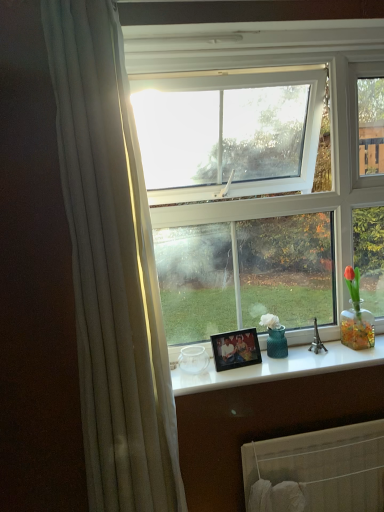
Question: Is the position of wooden photo frame at center more distant than that of white fabric radiator at lower center?

Choices:
 (A) yes
 (B) no

Answer: (A)

Question: From the image's perspective, is wooden photo frame at center on white fabric radiator at lower center?

Choices:
 (A) no
 (B) yes

Answer: (B)

Question: Does wooden photo frame at center appear on the right side of white fabric radiator at lower center?

Choices:
 (A) no
 (B) yes

Answer: (A)

Question: Would you consider wooden photo frame at center to be distant from white fabric radiator at lower center?

Choices:
 (A) yes
 (B) no

Answer: (B)

Question: Considering the relative sizes of wooden photo frame at center and white fabric radiator at lower center in the image provided, is wooden photo frame at center wider than white fabric radiator at lower center?

Choices:
 (A) no
 (B) yes

Answer: (A)

Question: In terms of height, does white fabric radiator at lower center look taller or shorter compared to wooden photo frame at center?

Choices:
 (A) short
 (B) tall

Answer: (B)

Question: Is white fabric radiator at lower center inside or outside of wooden photo frame at center?

Choices:
 (A) inside
 (B) outside

Answer: (B)

Question: Looking at their shapes, would you say white fabric radiator at lower center is wider or thinner than wooden photo frame at center?

Choices:
 (A) wide
 (B) thin

Answer: (A)

Question: Considering the relative positions of white fabric radiator at lower center and wooden photo frame at center in the image provided, is white fabric radiator at lower center to the left or to the right of wooden photo frame at center?

Choices:
 (A) right
 (B) left

Answer: (A)

Question: In the image, is white fabric radiator at lower center positioned in front of or behind white glossy counter top at center?

Choices:
 (A) behind
 (B) front

Answer: (A)

Question: From the image's perspective, is white fabric radiator at lower center positioned above or below white glossy counter top at center?

Choices:
 (A) below
 (B) above

Answer: (A)

Question: Considering the positions of white fabric radiator at lower center and white glossy counter top at center in the image, is white fabric radiator at lower center wider or thinner than white glossy counter top at center?

Choices:
 (A) wide
 (B) thin

Answer: (B)

Question: Considering the positions of point (380, 496) and point (281, 362), is point (380, 496) closer or farther from the camera than point (281, 362)?

Choices:
 (A) closer
 (B) farther

Answer: (B)

Question: Considering the positions of point (294, 375) and point (375, 460), is point (294, 375) closer or farther from the camera than point (375, 460)?

Choices:
 (A) closer
 (B) farther

Answer: (A)

Question: Considering the positions of white glossy counter top at center and white fabric radiator at lower center in the image, is white glossy counter top at center taller or shorter than white fabric radiator at lower center?

Choices:
 (A) short
 (B) tall

Answer: (A)